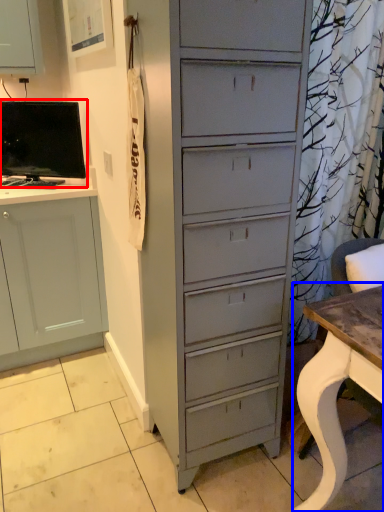
Question: Among these objects, which one is nearest to the camera, computer monitor (highlighted by a red box) or desk (highlighted by a blue box)?

Choices:
 (A) computer monitor
 (B) desk

Answer: (B)